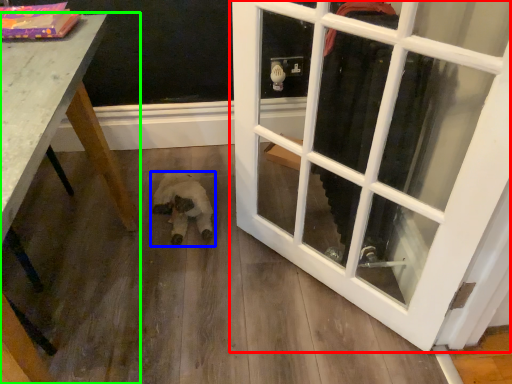
Question: Which object is the closest to the door (highlighted by a red box)? Choose among these: animal (highlighted by a blue box) or table (highlighted by a green box).

Choices:
 (A) animal
 (B) table

Answer: (A)